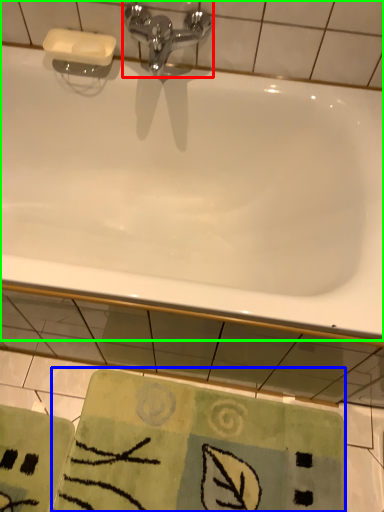
Question: Which is farther away from tap (highlighted by a red box)? beach towel (highlighted by a blue box) or bathtub (highlighted by a green box)?

Choices:
 (A) beach towel
 (B) bathtub

Answer: (A)